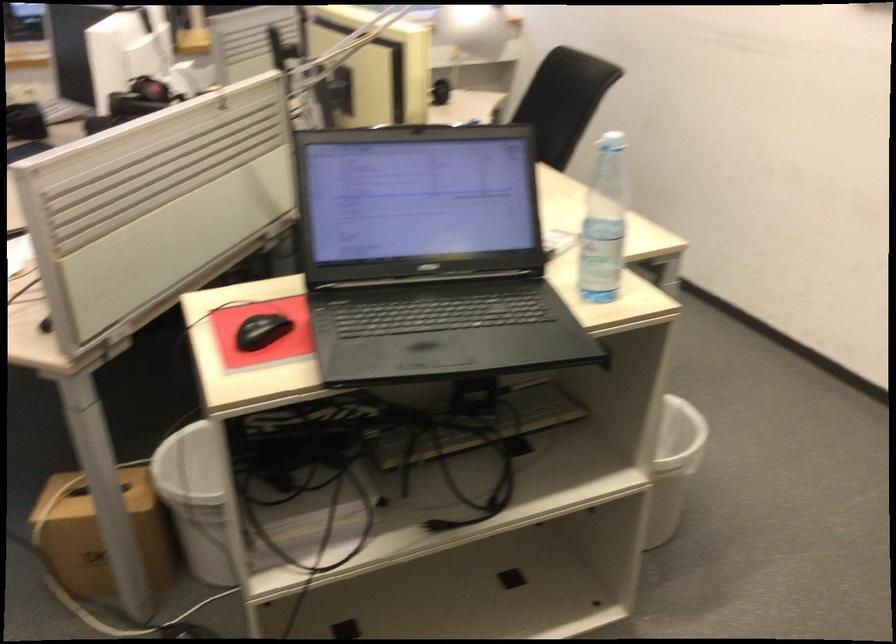
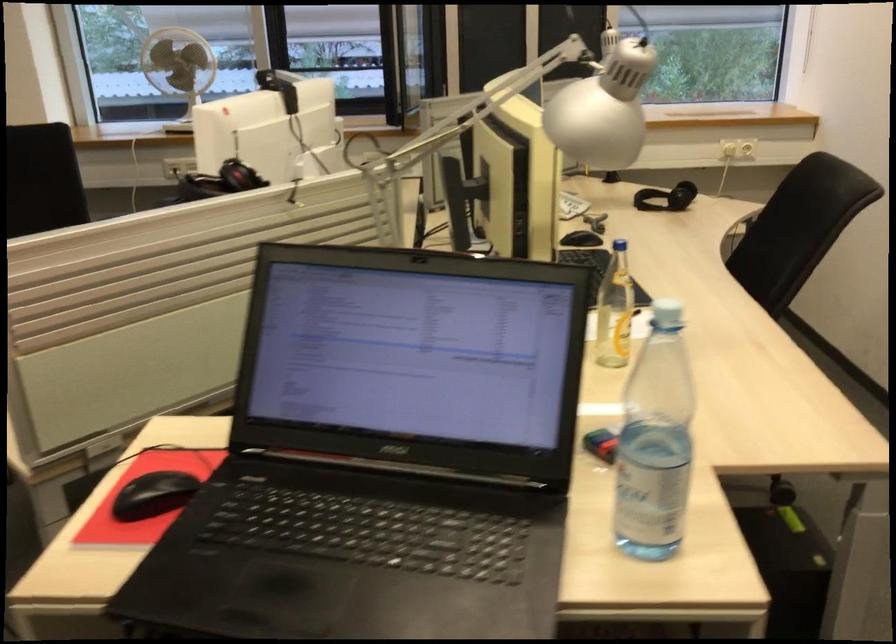
Question: The camera is either moving clockwise (left) or counter-clockwise (right) around the object. The first image is from the beginning of the video and the second image is from the end. Is the camera moving left or right when shooting the video?

Choices:
 (A) Left
 (B) Right

Answer: (B)